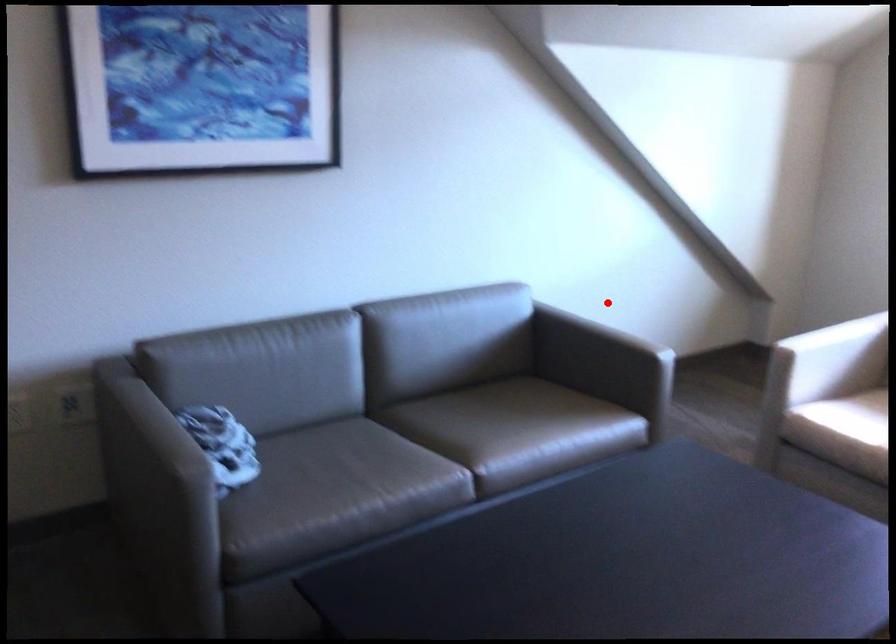
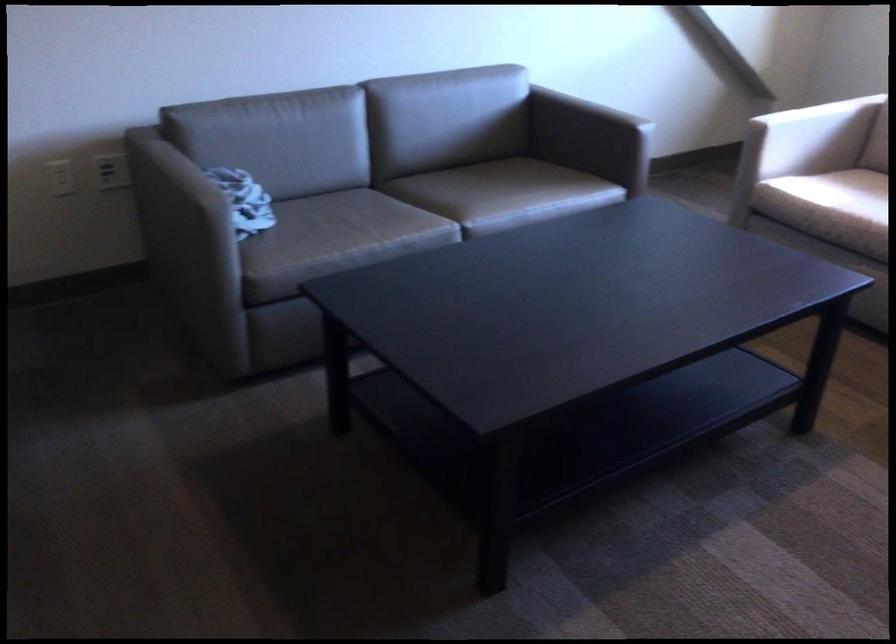
The point at the highlighted location is marked in the first image. Where is the corresponding point in the second image?

(605, 93)